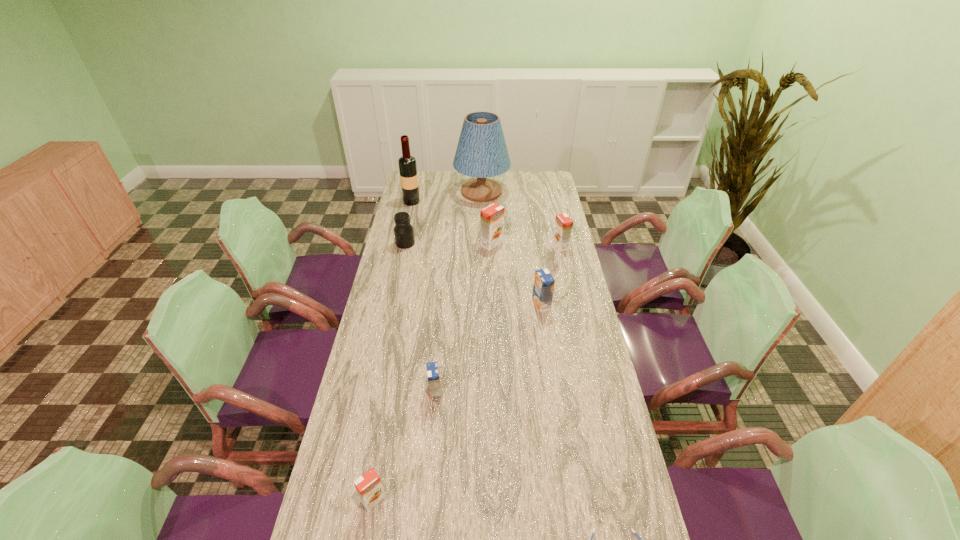
The height and width of the screenshot is (540, 960). What are the coordinates of `free space located on the back of the smallest orange orange juice` in the screenshot? It's located at (397, 364).

The height and width of the screenshot is (540, 960). I want to click on object at the far edge, so click(x=481, y=152).

The height and width of the screenshot is (540, 960). What are the coordinates of `wine bottle at the left edge` in the screenshot? It's located at (407, 164).

The width and height of the screenshot is (960, 540). I want to click on jar at the left edge, so click(403, 231).

Where is `orange juice located at the left edge`? orange juice located at the left edge is located at coordinates (369, 487).

I want to click on vacant area at the far edge of the desktop, so click(x=469, y=178).

Where is `vacant space at the left edge`? vacant space at the left edge is located at coordinates (376, 408).

Identify the location of vacant region at the right edge of the desktop. The height and width of the screenshot is (540, 960). (533, 216).

Find the location of a particular element. The width and height of the screenshot is (960, 540). vacant area that lies between the blue lampshade and the rightmost orange juice is located at coordinates (521, 219).

Find the location of a particular element. This screenshot has height=540, width=960. vacant space that is in between the left blue orange_juice and the sixth farthest object is located at coordinates (489, 348).